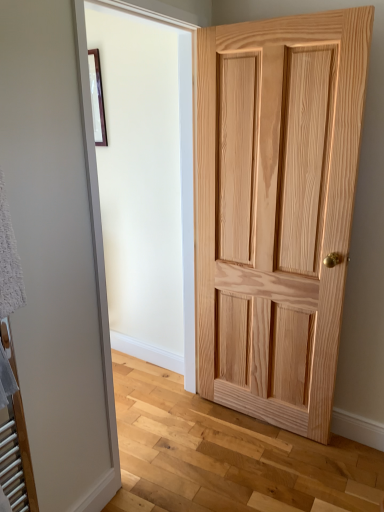
Where is `vacant space that is to the left of natural wood door at right`? Image resolution: width=384 pixels, height=512 pixels. vacant space that is to the left of natural wood door at right is located at coordinates (195, 439).